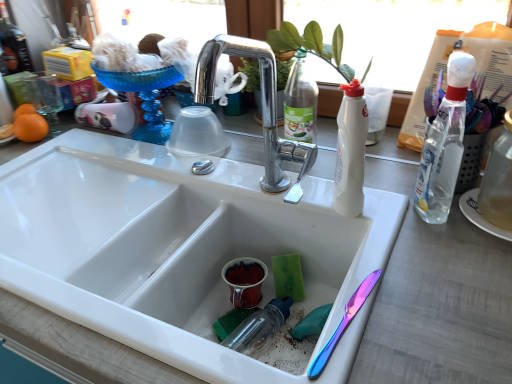
In order to click on vacant space to the right of white matte bottle at center, the 3th bottle positioned from the right in this screenshot , I will do `click(407, 209)`.